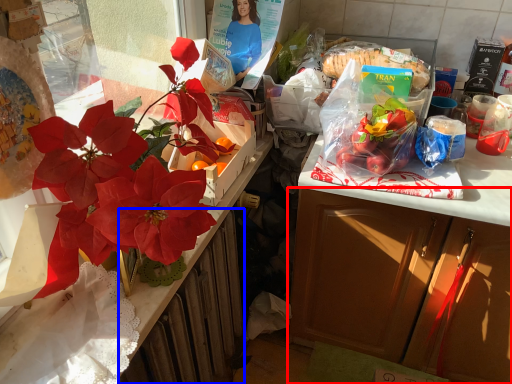
Question: Which object is closer to the camera taking this photo, cabinetry (highlighted by a red box) or radiator (highlighted by a blue box)?

Choices:
 (A) cabinetry
 (B) radiator

Answer: (A)